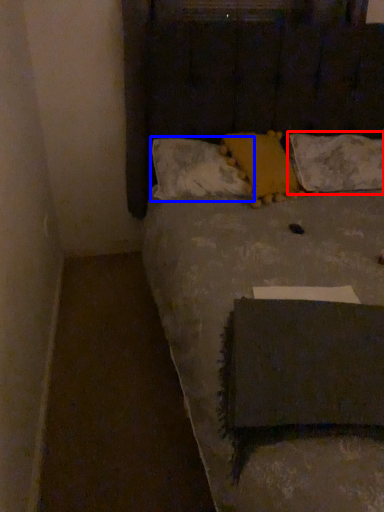
Question: Which point is further to the camera, pillow (highlighted by a red box) or pillow (highlighted by a blue box)?

Choices:
 (A) pillow
 (B) pillow

Answer: (A)